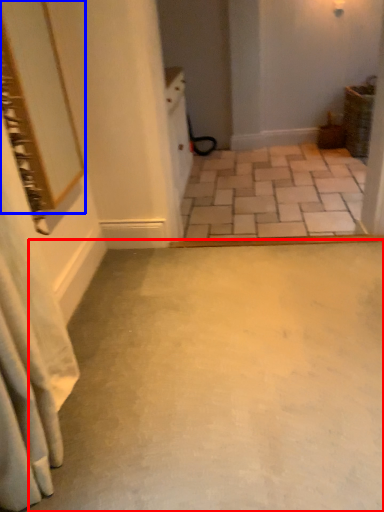
Question: Which object is further to the camera taking this photo, concrete (highlighted by a red box) or mirror (highlighted by a blue box)?

Choices:
 (A) concrete
 (B) mirror

Answer: (B)